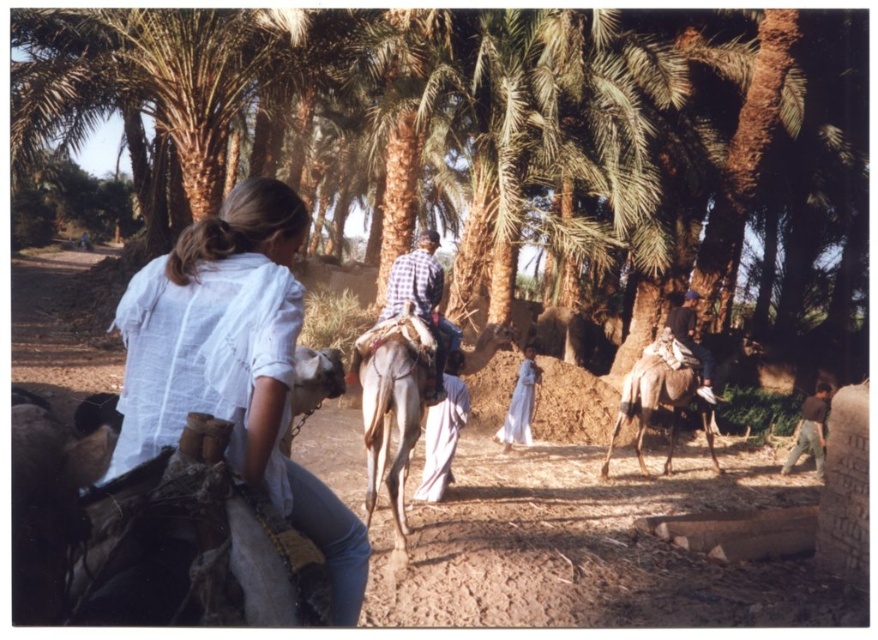
You are a photographer trying to capture a photo of the light brown textured camel at center and the brown cotton shirt at lower right. Which object should you focus on first if you want to include both in your frame without moving the camera?

The light brown textured camel at center is much taller than the brown cotton shirt at lower right, so you should focus on the camel first to ensure it fits within the frame since it is taller.

You are a photographer positioned in the palm grove. You need to capture a photo where both the white cotton shirt at center and the white textured camel at center are clearly visible. Based on their positions, which object is closer to the camera?

The white cotton shirt at center is closer to the camera than the white textured camel at center because the camel is behind the shirt.

Based on the photo, you are a photographer trying to capture a clear shot of the white cotton shirt at center and the white textured camel at center. Which object should you focus on first if you want to ensure both are in focus without adjusting the camera settings?

You should focus on the white textured camel at center first because it occupies more space and will require a smaller depth of field to keep both in focus.